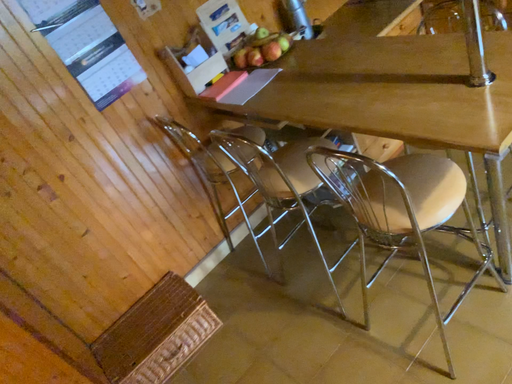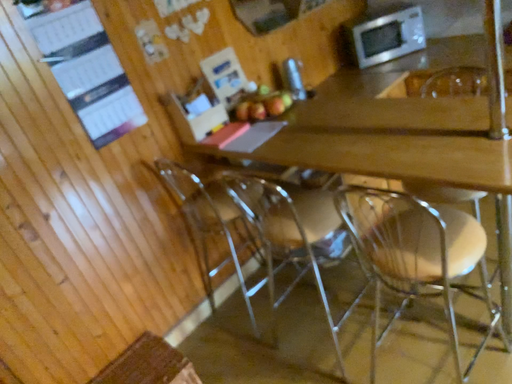
Question: How did the camera likely rotate when shooting the video?

Choices:
 (A) rotated downward
 (B) rotated upward

Answer: (B)